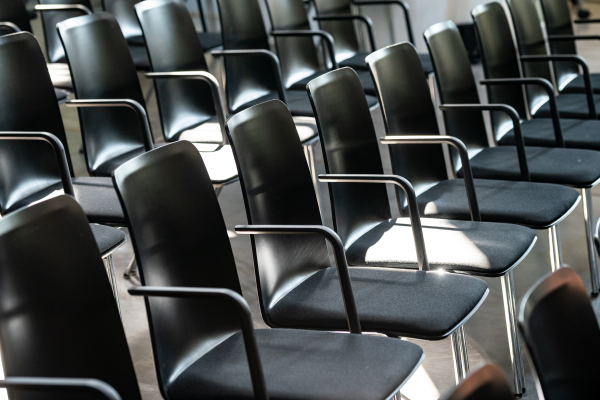
Find the location of a particular element. The image size is (600, 400). chair legs is located at coordinates (588, 213), (550, 246), (507, 292), (456, 348), (108, 260), (310, 156), (397, 394).